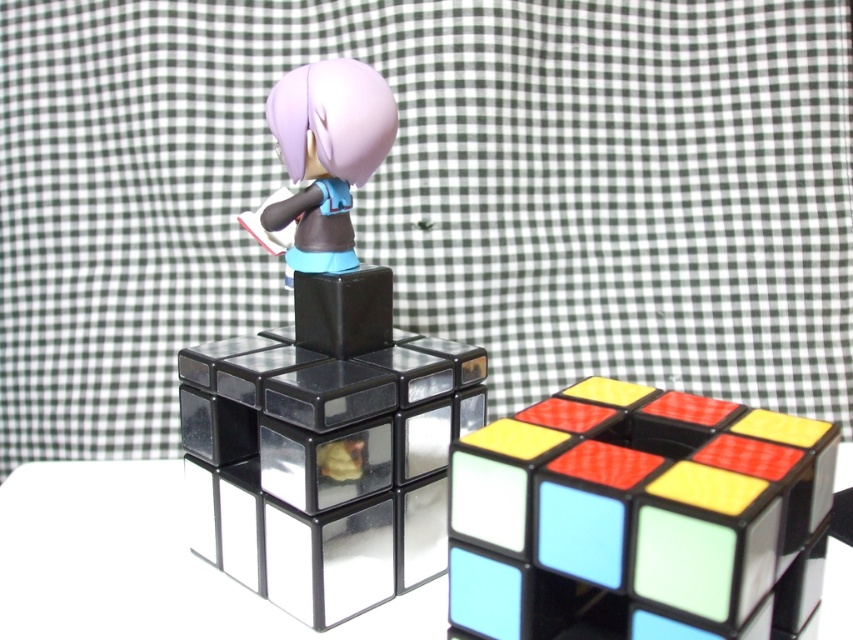
Identify the location of matte black figurine at center. (323, 387).

Which is more to the left, matte black figurine at center or rubberized plastic rubik's cube at center?

matte black figurine at center is more to the left.

Which is behind, point (294, 353) or point (523, 518)?

Point (294, 353)

The image size is (853, 640). Identify the location of matte black figurine at center. (323, 387).

From the picture: Between rubberized plastic rubik's cube at center and matte plastic doll at center, which one appears on the right side from the viewer's perspective?

rubberized plastic rubik's cube at center is more to the right.

Is rubberized plastic rubik's cube at center wider than matte plastic doll at center?

Correct, the width of rubberized plastic rubik's cube at center exceeds that of matte plastic doll at center.

This screenshot has width=853, height=640. Identify the location of rubberized plastic rubik's cube at center. (631, 508).

Identify the location of rubberized plastic rubik's cube at center. pos(631,508).

Does matte black figurine at center have a lesser width compared to matte plastic doll at center?

Incorrect, matte black figurine at center's width is not less than matte plastic doll at center's.

Is point (328, 570) farther from camera compared to point (286, 138)?

That is False.

Who is more forward, (225,458) or (334,236)?

Point (334,236)

Where is `matte black figurine at center`? Image resolution: width=853 pixels, height=640 pixels. matte black figurine at center is located at coordinates (323, 387).